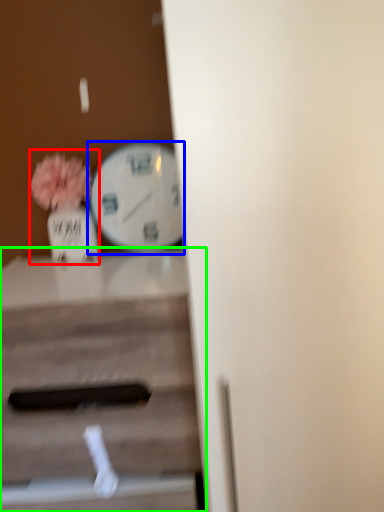
Question: Which object is positioned farthest from floral arrangement (highlighted by a red box)? Select from wall clock (highlighted by a blue box) and table (highlighted by a green box).

Choices:
 (A) wall clock
 (B) table

Answer: (B)